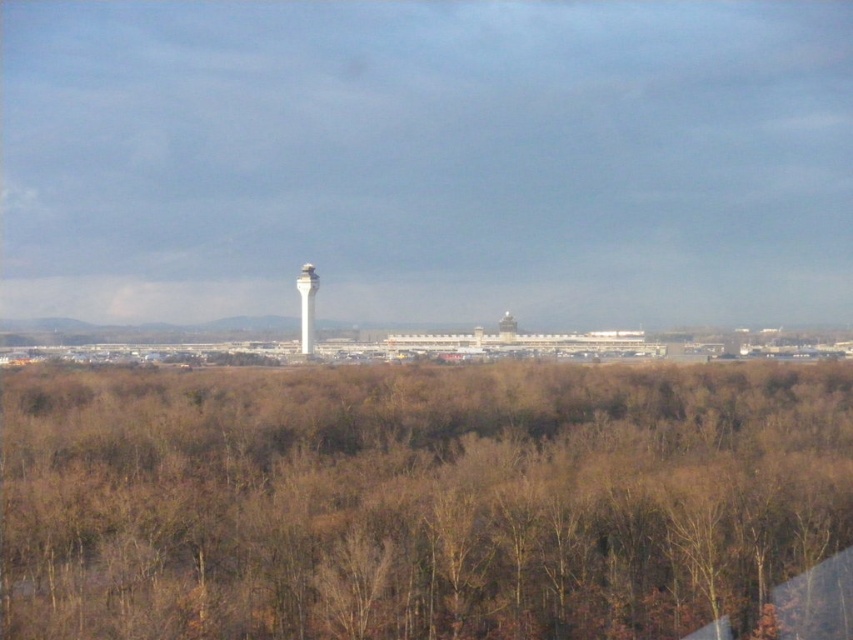
Is brown leafless trees at center to the left of white smooth tower at center from the viewer's perspective?

No, brown leafless trees at center is not to the left of white smooth tower at center.

Between brown leafless trees at center and white smooth tower at center, which one appears on the right side from the viewer's perspective?

From the viewer's perspective, brown leafless trees at center appears more on the right side.

Describe the element at coordinates (415, 499) in the screenshot. The width and height of the screenshot is (853, 640). I see `brown leafless trees at center` at that location.

You are a GUI agent. You are given a task and a screenshot of the screen. Output one action in this format:
    pyautogui.click(x=<x>, y=<y>)
    Task: Click on the brown leafless trees at center
    
    Given the screenshot: What is the action you would take?
    pyautogui.click(x=415, y=499)